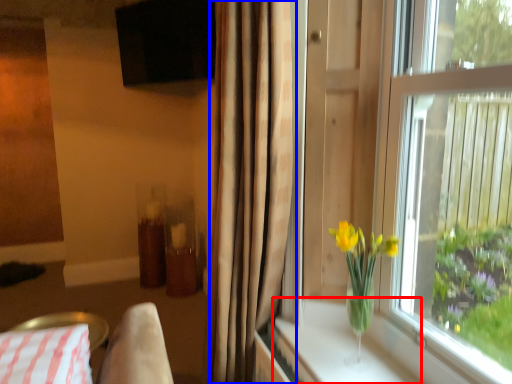
Question: Which point is closer to the camera, window sill (highlighted by a red box) or curtain (highlighted by a blue box)?

Choices:
 (A) window sill
 (B) curtain

Answer: (B)